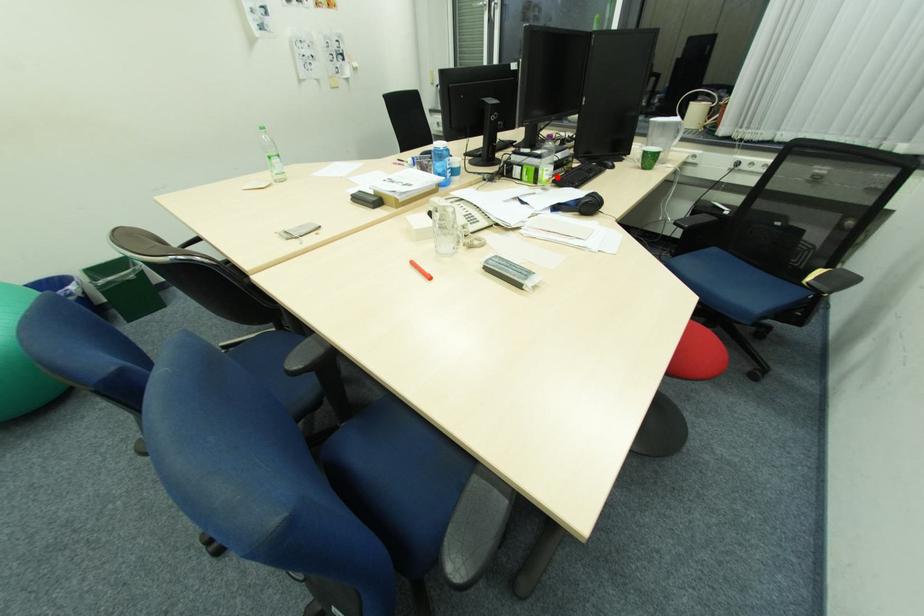
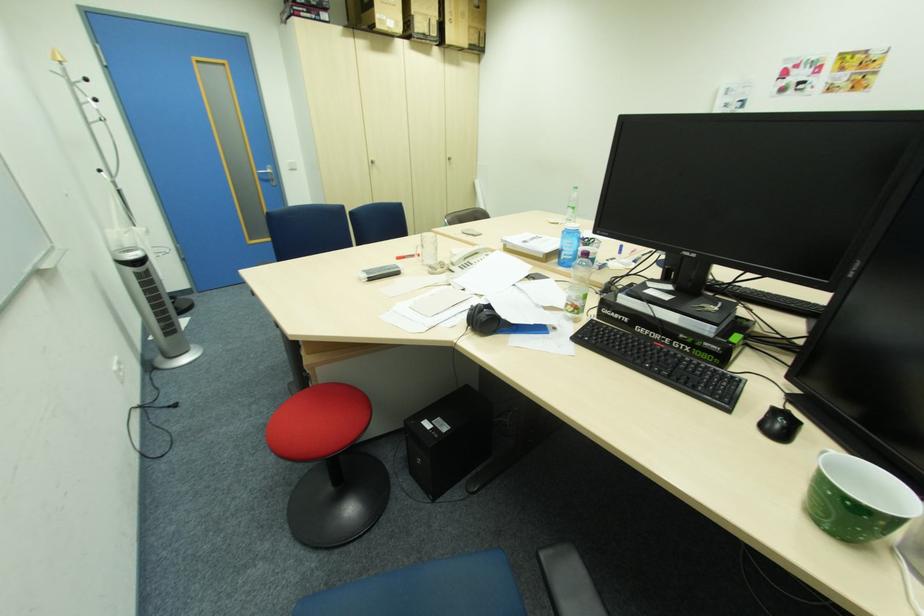
In the second image, find the point that corresponds to the highlighted location in the first image.

(575, 304)